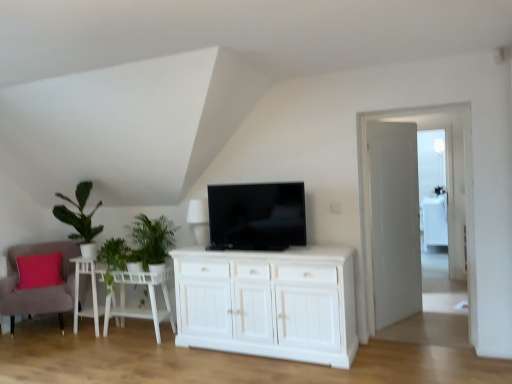
You are a GUI agent. You are given a task and a screenshot of the screen. Output one action in this format:
    pyautogui.click(x=<x>, y=<y>)
    Task: Click on the vacant space in white wooden door at right (from a real-world perspective)
    Image resolution: width=512 pixels, height=384 pixels.
    Given the screenshot: What is the action you would take?
    pyautogui.click(x=401, y=321)